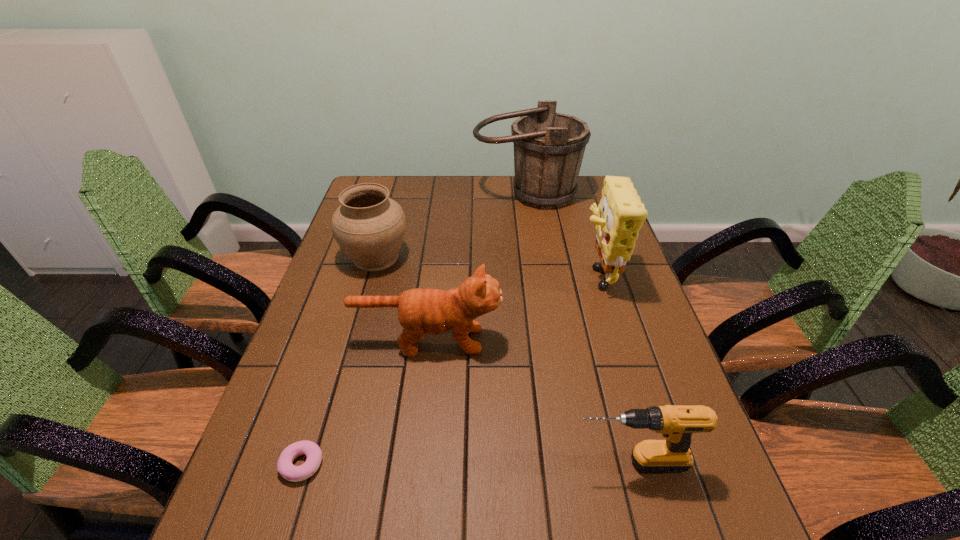
Where is `the farthest object`? The height and width of the screenshot is (540, 960). the farthest object is located at coordinates (549, 147).

The height and width of the screenshot is (540, 960). I want to click on sponge, so click(620, 215).

Identify the location of cat. Image resolution: width=960 pixels, height=540 pixels. (421, 311).

The image size is (960, 540). I want to click on urn, so click(x=370, y=227).

Find the location of `drill`. drill is located at coordinates (676, 423).

Image resolution: width=960 pixels, height=540 pixels. Find the location of `pastry`. pastry is located at coordinates (293, 473).

Identify the location of vacant space located 0.130m on the handle side of the bucket. This screenshot has width=960, height=540. (533, 236).

I want to click on vacant area located on the face of the sponge, so click(442, 273).

Identify the location of free space located 0.070m on the face of the sponge. This screenshot has height=540, width=960. (553, 273).

Locate an element on the screen. The height and width of the screenshot is (540, 960). vacant space located 0.170m on the face of the sponge is located at coordinates [x=519, y=273].